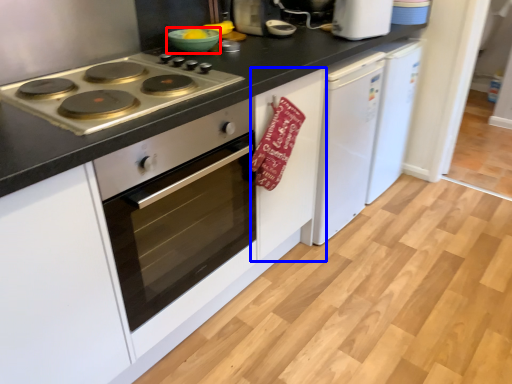
Question: Which point is closer to the camera, bowl (highlighted by a red box) or cabinetry (highlighted by a blue box)?

Choices:
 (A) bowl
 (B) cabinetry

Answer: (B)